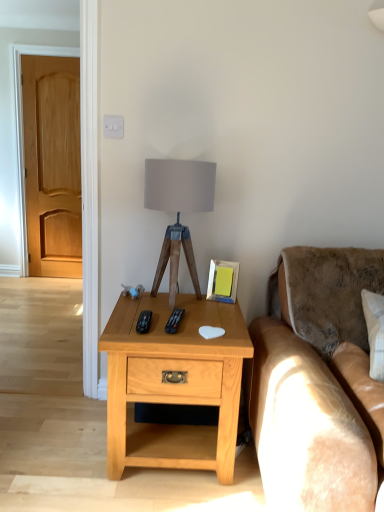
Locate an element on the screen. free space on the front side of matte gray fabric at center is located at coordinates pyautogui.click(x=173, y=321).